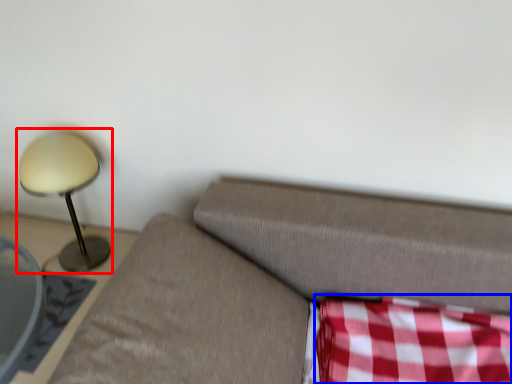
Question: Among these objects, which one is nearest to the camera, lamp (highlighted by a red box) or plaid (highlighted by a blue box)?

Choices:
 (A) lamp
 (B) plaid

Answer: (B)